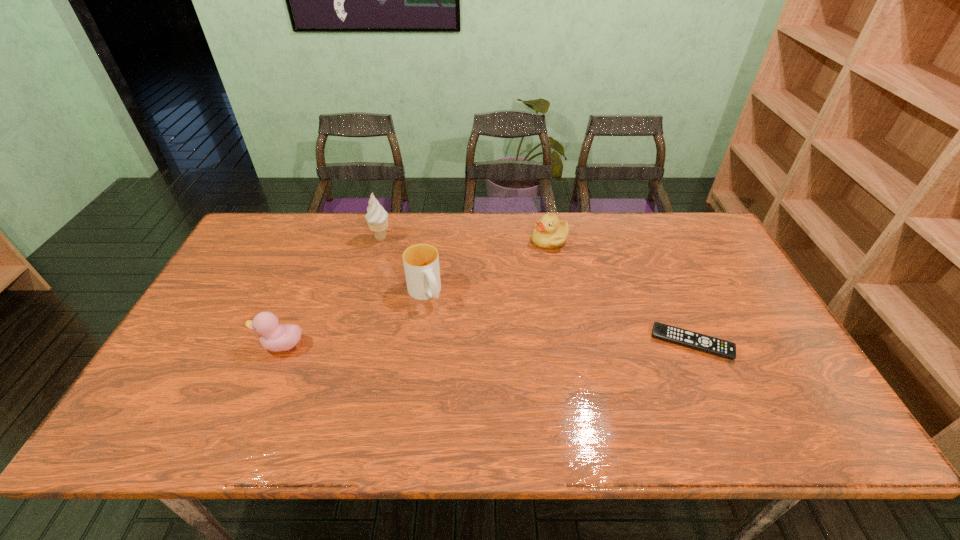
I want to click on free space at the far right corner, so click(684, 254).

Locate an element on the screen. This screenshot has height=540, width=960. vacant area between the tallest object and the cup is located at coordinates point(402,266).

At what (x,y) coordinates should I click in order to perform the action: click on vacant region between the shortest object and the tallest object. Please return your answer as a coordinate pair (x, y). This screenshot has height=540, width=960. Looking at the image, I should click on (536, 291).

You are a GUI agent. You are given a task and a screenshot of the screen. Output one action in this format:
    pyautogui.click(x=<x>, y=<y>)
    Task: Click on the free spot between the remote control and the tallest object
    The image size is (960, 540).
    Given the screenshot: What is the action you would take?
    pyautogui.click(x=536, y=291)

What are the coordinates of `free point between the nearer duckling and the icecream` in the screenshot? It's located at (330, 292).

Identify the location of empty space between the nearer duckling and the shortest object. The height and width of the screenshot is (540, 960). click(486, 344).

Locate an element on the screen. Image resolution: width=960 pixels, height=540 pixels. empty location between the second object from right to left and the remote control is located at coordinates (621, 292).

Locate an element on the screen. This screenshot has height=540, width=960. vacant space that's between the rightmost object and the left duckling is located at coordinates (486, 344).

Identify the location of vacant area that lies between the fourth object from left to right and the third farthest object. The image size is (960, 540). (487, 267).

Locate an element on the screen. vacant space that is in between the nearer duckling and the remote control is located at coordinates (486, 344).